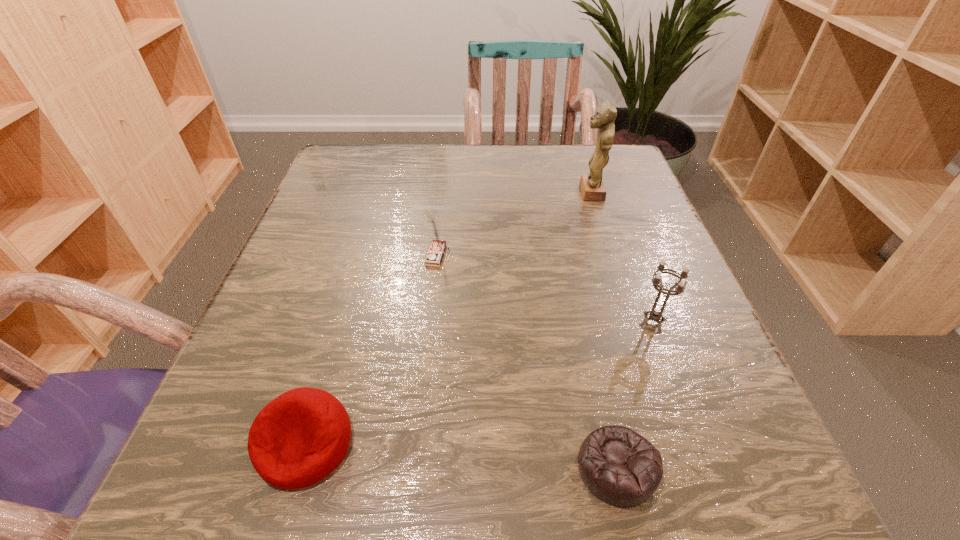
This screenshot has width=960, height=540. I want to click on vacant area that lies between the leftmost object and the right beanbag, so click(x=461, y=456).

At what (x,y) coordinates should I click in order to perform the action: click on vacant point located between the tallest object and the right beanbag. Please return your answer as a coordinate pair (x, y). This screenshot has width=960, height=540. Looking at the image, I should click on (603, 330).

This screenshot has height=540, width=960. In order to click on vacant region between the matchbox and the figurine in this screenshot , I will do `click(514, 224)`.

At what (x,y) coordinates should I click in order to perform the action: click on unoccupied position between the candle holder and the matchbox. Please return your answer as a coordinate pair (x, y). Looking at the image, I should click on (545, 288).

Find the location of `vacant space that is in between the second object from left to right and the third nearest object`. vacant space that is in between the second object from left to right and the third nearest object is located at coordinates (545, 288).

Locate an element on the screen. The width and height of the screenshot is (960, 540). vacant area that lies between the third farthest object and the right beanbag is located at coordinates (635, 395).

Identify the location of vacant region between the leftmost object and the tallest object. (447, 318).

Where is `unoccupied position between the second object from left to right and the candle holder`? unoccupied position between the second object from left to right and the candle holder is located at coordinates (545, 288).

Where is `free area in between the second object from left to right and the farthest object`? This screenshot has height=540, width=960. free area in between the second object from left to right and the farthest object is located at coordinates (514, 224).

Where is `vacant point located between the shorter beanbag and the matchbox`? vacant point located between the shorter beanbag and the matchbox is located at coordinates (527, 361).